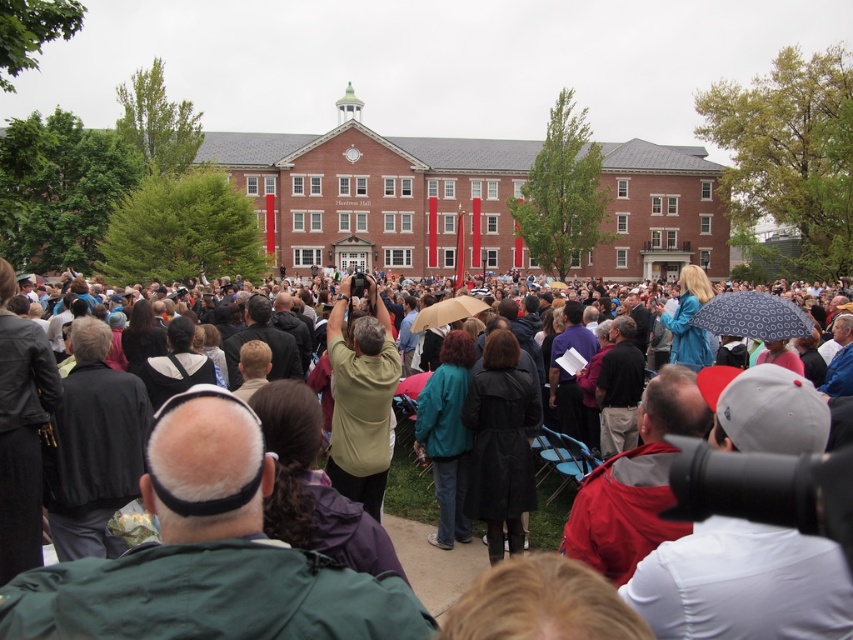
You are at an outdoor event and see two people standing in front of you. One is wearing a dark gray coat at center and the other is wearing a matte green shirt at center. Which clothing item is positioned lower on their bodies?

The dark gray coat at center is below matte green shirt at center, so the dark gray coat at center is positioned lower on their bodies.

You are at an outdoor event near Huntress Hall and need to locate two people wearing a dark gray coat at center and a matte green shirt at center. Which clothing item is taller?

The dark gray coat at center is taller than the matte green shirt at center.

You are standing in the crowd at the event and want to take a photo of both the point at location (560, 516) and the point at (346, 442). Which point will appear larger in your photo?

Point at location (560, 516) will appear larger in the photo because it is closer to the camera than point at (346, 442).